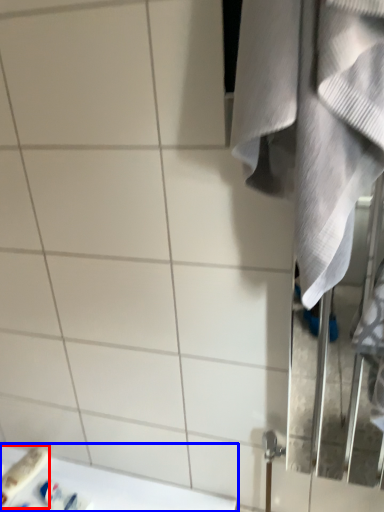
Question: Which point is closer to the camera, toiletry (highlighted by a red box) or counter top (highlighted by a blue box)?

Choices:
 (A) toiletry
 (B) counter top

Answer: (B)